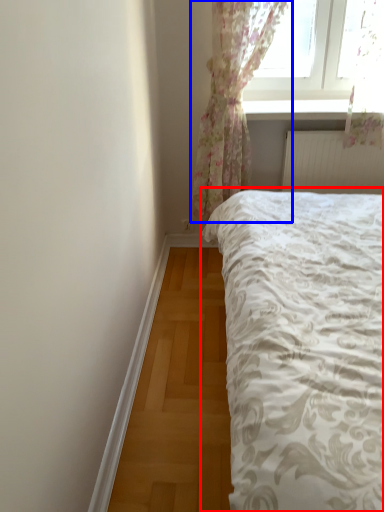
Question: Which point is closer to the camera, bed (highlighted by a red box) or curtain (highlighted by a blue box)?

Choices:
 (A) bed
 (B) curtain

Answer: (A)